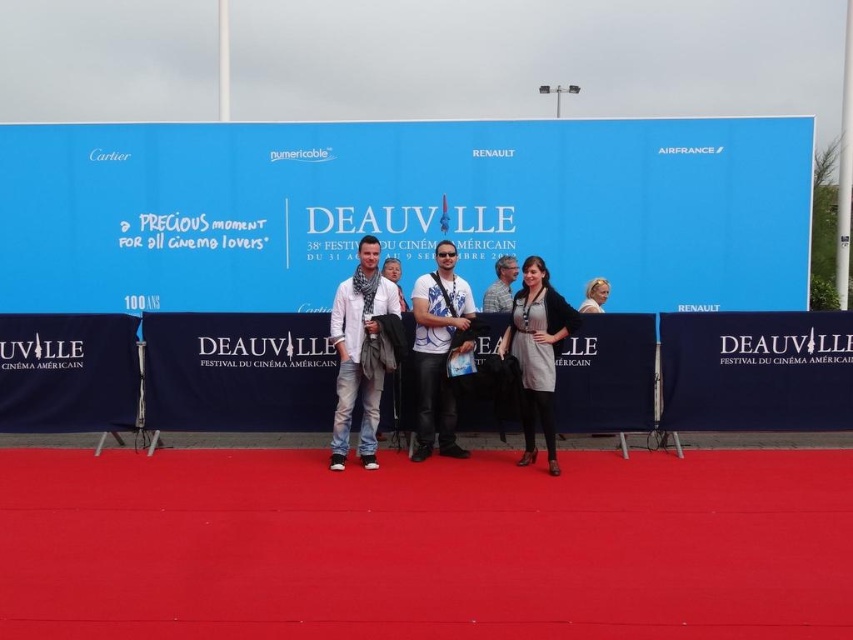
Can you confirm if matte white shirt at center is positioned below gray fabric dress at center?

Incorrect, matte white shirt at center is not positioned below gray fabric dress at center.

Between matte white shirt at center and gray fabric dress at center, which one appears on the right side from the viewer's perspective?

gray fabric dress at center is more to the right.

Does point (428, 394) lie in front of point (552, 404)?

That is False.

Where is `matte white shirt at center`? matte white shirt at center is located at coordinates (439, 352).

Does matte white shirt at center appear on the left side of white fabric headscarf at upper right?

Correct, you'll find matte white shirt at center to the left of white fabric headscarf at upper right.

Where is `matte white shirt at center`? The image size is (853, 640). matte white shirt at center is located at coordinates (439, 352).

Where is `matte white shirt at center`? This screenshot has width=853, height=640. matte white shirt at center is located at coordinates (439, 352).

Does gray fabric dress at center have a smaller size compared to gray striped shirt at center?

No, gray fabric dress at center is not smaller than gray striped shirt at center.

Which is in front, point (553, 468) or point (505, 292)?

Point (553, 468) is in front.

Is point (531, 385) farther from camera compared to point (508, 260)?

No, (531, 385) is closer to viewer.

Where is `gray fabric dress at center`? This screenshot has width=853, height=640. gray fabric dress at center is located at coordinates (537, 353).